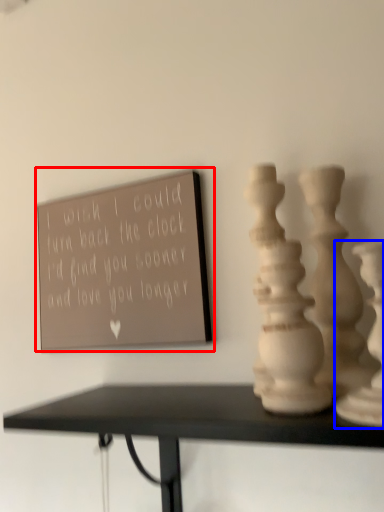
Question: Among these objects, which one is farthest to the camera, bulletin board (highlighted by a red box) or vase (highlighted by a blue box)?

Choices:
 (A) bulletin board
 (B) vase

Answer: (A)